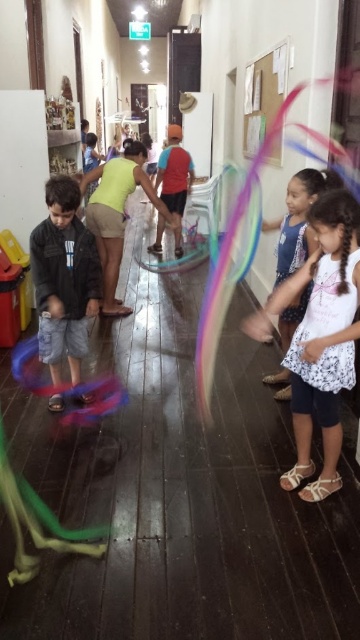
You are a photographer setting up for a group photo in the hallway. You need to ensure that all participants are visible. The white floral dress at right and the matte red shirt at center are both important to capture. Considering their heights, which one might require you to adjust your camera angle to avoid being blocked by others?

The white floral dress at right is shorter than the matte red shirt at center, so the white floral dress at right might be partially blocked by taller participants. Adjusting the camera angle slightly upward could help ensure it remains visible.

You are standing at the starting point in the hallway and want to reach a point that is closer to the camera. Which point should you move towards, point (294, 381) or point (176, 182)?

You should move towards point (294, 381) because it is closer to the camera than point (176, 182).